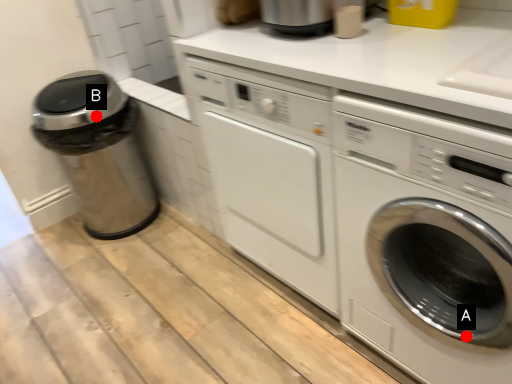
Question: Two points are circled on the image, labeled by A and B beside each circle. Which of the following is the closest to the observer?

Choices:
 (A) A is closer
 (B) B is closer

Answer: (A)